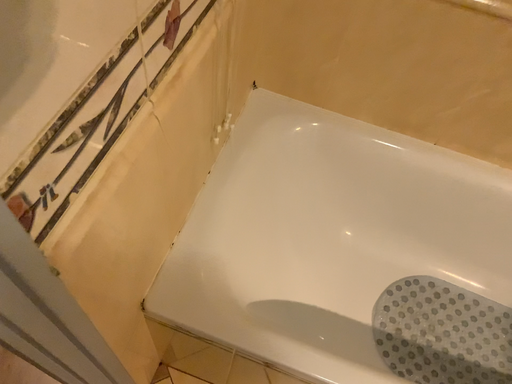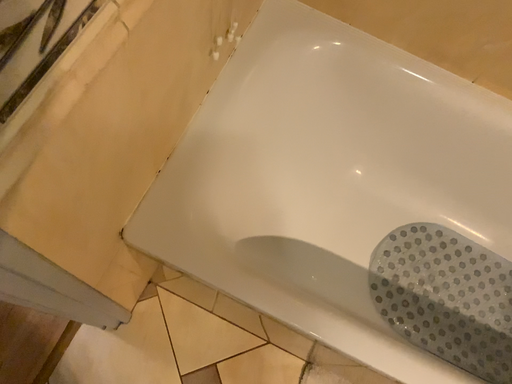
Question: How did the camera likely rotate when shooting the video?

Choices:
 (A) rotated upward
 (B) rotated downward

Answer: (B)